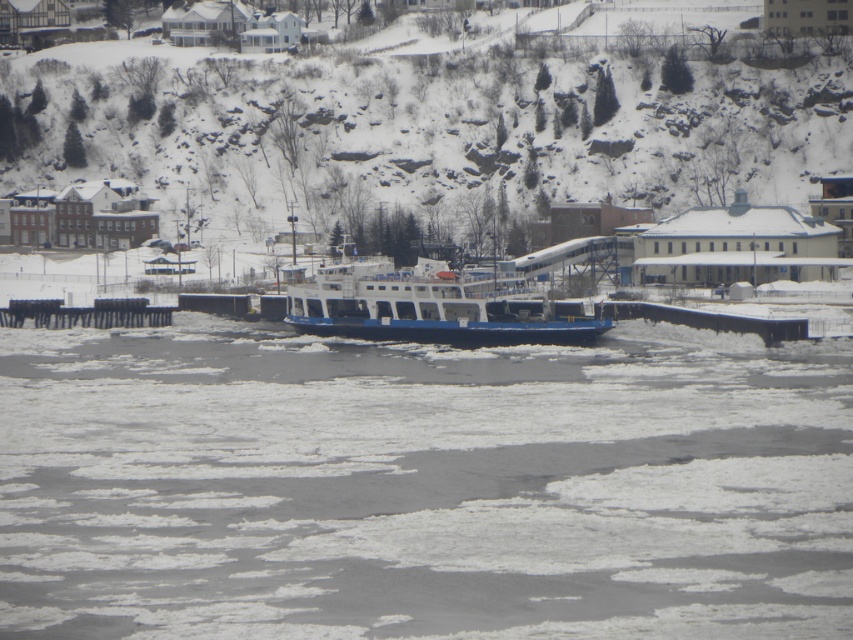
You are a photographer planning to capture a landscape shot of the winter ferry scene. You have a camera with a standard lens that can focus on objects up to 100 meters away. The snowy rock at upper center and the blue matte ferry at center are both in your frame. Considering their heights, which object will appear larger in your photo?

The snowy rock at upper center is taller than the blue matte ferry at center, so it will appear larger in the photo.